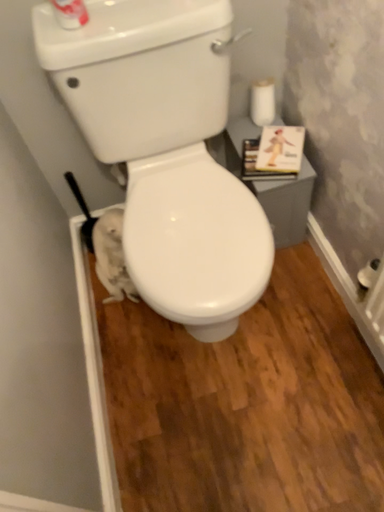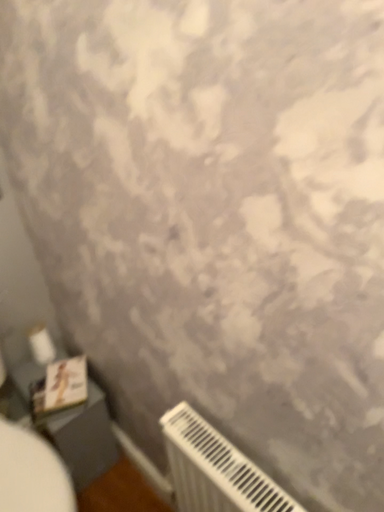
Question: How did the camera likely rotate when shooting the video?

Choices:
 (A) rotated left
 (B) rotated right

Answer: (B)